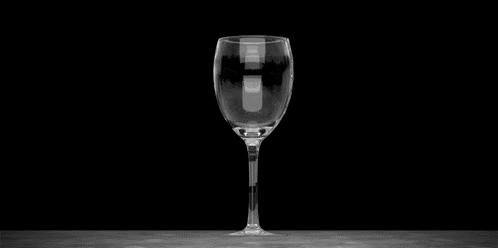
Where is `wine glass`? Image resolution: width=498 pixels, height=248 pixels. wine glass is located at coordinates (265, 88).